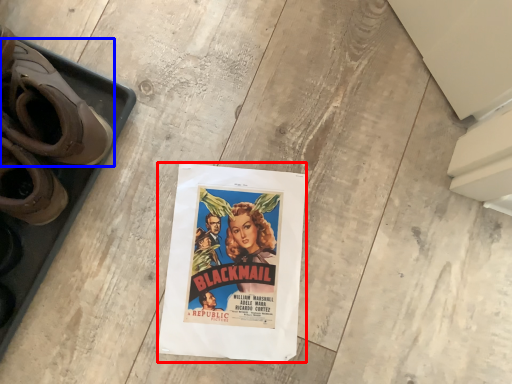
Question: Which object is further to the camera taking this photo, poster (highlighted by a red box) or footwear (highlighted by a blue box)?

Choices:
 (A) poster
 (B) footwear

Answer: (A)